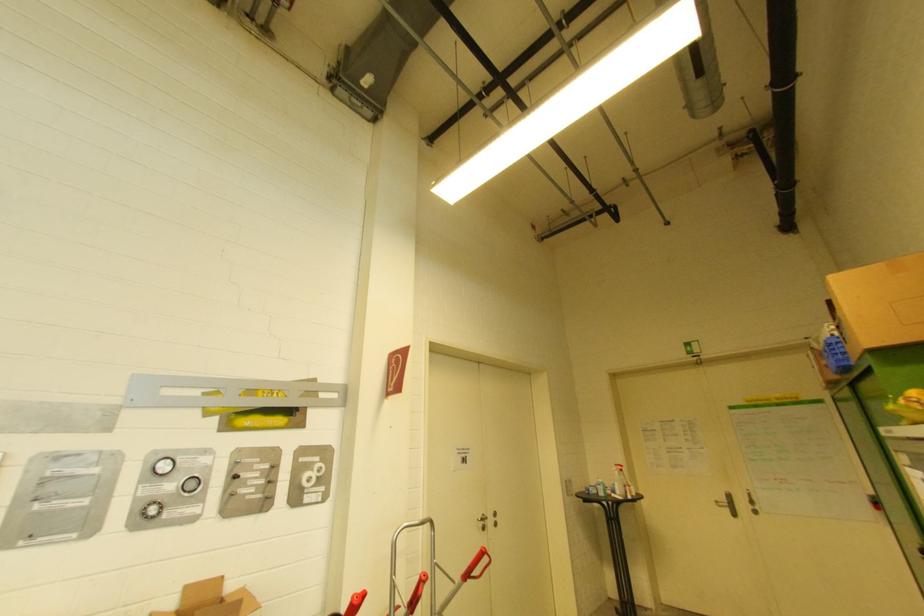
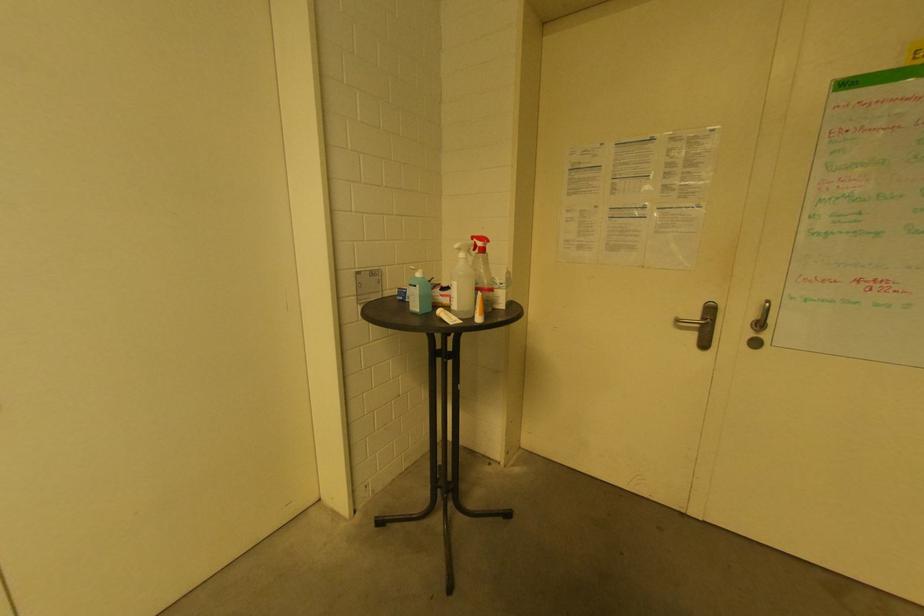
The point at (618, 474) is marked in the first image. Where is the corresponding point in the second image?

(464, 256)